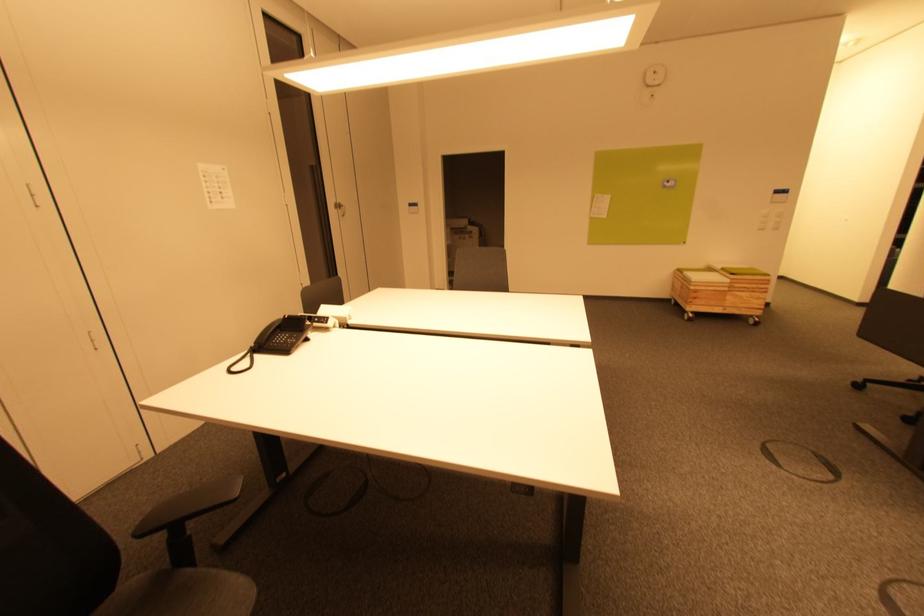
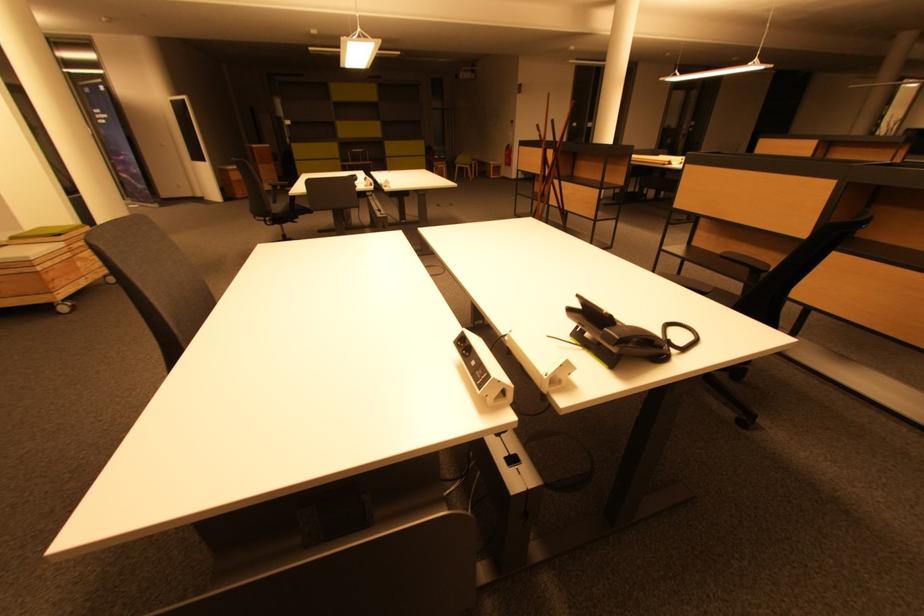
Find the pixel in the second image that matches pixel 733 300 in the first image.

(83, 265)